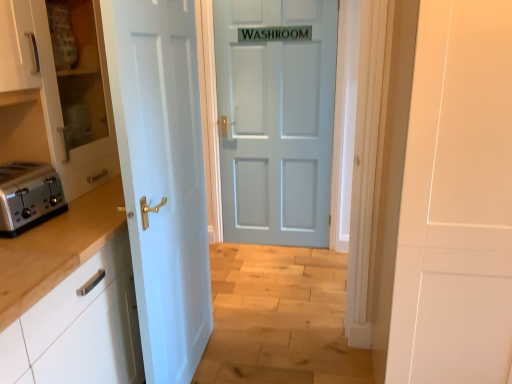
The width and height of the screenshot is (512, 384). What are the coordinates of `white glossy cabinet at left, the 1th cabinetry ordered from the bottom` in the screenshot? It's located at (80, 327).

Image resolution: width=512 pixels, height=384 pixels. What do you see at coordinates (57, 95) in the screenshot?
I see `white glossy cabinet at left, the first cabinetry in the top-to-bottom sequence` at bounding box center [57, 95].

This screenshot has height=384, width=512. In order to click on satin silver toaster at left in this screenshot , I will do `click(28, 196)`.

Is white glossy cabinet at left, acting as the second cabinetry starting from the top, aimed at light blue matte door at center, placed as the second door when sorted from left to right?

No, white glossy cabinet at left, acting as the second cabinetry starting from the top, is not oriented towards light blue matte door at center, placed as the second door when sorted from left to right.

Is white glossy cabinet at left, acting as the second cabinetry starting from the top, in contact with light blue matte door at center, positioned as the 1th door in right-to-left order?

They are not placed beside each other.

From a real-world perspective, which is physically below, white glossy cabinet at left, the 1th cabinetry ordered from the bottom, or light blue matte door at center, placed as the second door when sorted from left to right?

white glossy cabinet at left, the 1th cabinetry ordered from the bottom, from a real-world perspective.

Considering the sizes of white glossy cabinet at left, acting as the second cabinetry starting from the top, and light blue matte door at center, placed as the second door when sorted from left to right, in the image, is white glossy cabinet at left, acting as the second cabinetry starting from the top, wider or thinner than light blue matte door at center, placed as the second door when sorted from left to right,?

In the image, white glossy cabinet at left, acting as the second cabinetry starting from the top, appears to be wider than light blue matte door at center, placed as the second door when sorted from left to right.

Would you consider white painted wood door at left, positioned as the second door in back-to-front order, to be distant from satin silver toaster at left?

No, white painted wood door at left, positioned as the second door in back-to-front order, is in close proximity to satin silver toaster at left.

From a real-world perspective, who is located higher, white painted wood door at left, the 2th door viewed from the right, or satin silver toaster at left?

satin silver toaster at left is physically above.

Does point (127, 106) lie behind point (61, 205)?

No, it is not.

Is white painted wood door at left, the 2th door viewed from the right, turned away from satin silver toaster at left?

That's right, white painted wood door at left, the 2th door viewed from the right, is facing away from satin silver toaster at left.

From the image's perspective, which object appears higher, white glossy cabinet at left, the first cabinetry in the top-to-bottom sequence, or white glossy cabinet at left, the 1th cabinetry ordered from the bottom?

white glossy cabinet at left, the first cabinetry in the top-to-bottom sequence.

What's the angular difference between white glossy cabinet at left, the first cabinetry in the top-to-bottom sequence, and white glossy cabinet at left, the 1th cabinetry ordered from the bottom,'s facing directions?

There is a 0.953-degree angle between the facing directions of white glossy cabinet at left, the first cabinetry in the top-to-bottom sequence, and white glossy cabinet at left, the 1th cabinetry ordered from the bottom.

From a real-world perspective, is white glossy cabinet at left, which ranks as the 2th cabinetry in bottom-to-top order, positioned over white glossy cabinet at left, acting as the second cabinetry starting from the top, based on gravity?

Yes, from a real-world perspective, white glossy cabinet at left, which ranks as the 2th cabinetry in bottom-to-top order, is above white glossy cabinet at left, acting as the second cabinetry starting from the top.

Does white glossy cabinet at left, which ranks as the 2th cabinetry in bottom-to-top order, have a smaller size compared to white glossy cabinet at left, the 1th cabinetry ordered from the bottom?

Indeed, white glossy cabinet at left, which ranks as the 2th cabinetry in bottom-to-top order, has a smaller size compared to white glossy cabinet at left, the 1th cabinetry ordered from the bottom.

Consider the image. Is light blue matte door at center, placed as the second door when sorted from left to right, wider or thinner than white glossy cabinet at left, which ranks as the 2th cabinetry in bottom-to-top order?

In the image, light blue matte door at center, placed as the second door when sorted from left to right, appears to be more narrow than white glossy cabinet at left, which ranks as the 2th cabinetry in bottom-to-top order.

Based on their sizes in the image, would you say light blue matte door at center, placed as the second door when sorted from left to right, is bigger or smaller than white glossy cabinet at left, which ranks as the 2th cabinetry in bottom-to-top order?

Considering their sizes, light blue matte door at center, placed as the second door when sorted from left to right, takes up less space than white glossy cabinet at left, which ranks as the 2th cabinetry in bottom-to-top order.

This screenshot has height=384, width=512. Identify the location of the 1st door positioned below the white glossy cabinet at left, the first cabinetry in the top-to-bottom sequence (from a real-world perspective). (276, 118).

Is light blue matte door at center, which is the 1th door in back-to-front order, not close to white glossy cabinet at left, which ranks as the 2th cabinetry in bottom-to-top order?

Yes, light blue matte door at center, which is the 1th door in back-to-front order, is far from white glossy cabinet at left, which ranks as the 2th cabinetry in bottom-to-top order.

There is a white glossy cabinet at left, the 1th cabinetry ordered from the bottom. Where is `the 2nd door above it (from a real-world perspective)`? This screenshot has height=384, width=512. the 2nd door above it (from a real-world perspective) is located at coordinates (276, 118).

From the image's perspective, is light blue matte door at center, positioned as the 1th door in right-to-left order, above white glossy cabinet at left, acting as the second cabinetry starting from the top?

Yes, from the image's perspective, light blue matte door at center, positioned as the 1th door in right-to-left order, is over white glossy cabinet at left, acting as the second cabinetry starting from the top.

Considering the relative sizes of light blue matte door at center, positioned as the 1th door in right-to-left order, and white glossy cabinet at left, acting as the second cabinetry starting from the top, in the image provided, is light blue matte door at center, positioned as the 1th door in right-to-left order, wider than white glossy cabinet at left, acting as the second cabinetry starting from the top,?

In fact, light blue matte door at center, positioned as the 1th door in right-to-left order, might be narrower than white glossy cabinet at left, acting as the second cabinetry starting from the top.

Is light blue matte door at center, placed as the second door when sorted from left to right, aimed at white glossy cabinet at left, acting as the second cabinetry starting from the top?

Yes, light blue matte door at center, placed as the second door when sorted from left to right, is facing white glossy cabinet at left, acting as the second cabinetry starting from the top.

Is white glossy cabinet at left, the first cabinetry in the top-to-bottom sequence, inside the boundaries of white painted wood door at left, the 2th door viewed from the right, or outside?

white glossy cabinet at left, the first cabinetry in the top-to-bottom sequence, lies outside white painted wood door at left, the 2th door viewed from the right.

From a real-world perspective, is white glossy cabinet at left, which ranks as the 2th cabinetry in bottom-to-top order, under white painted wood door at left, marked as the first door in a left-to-right arrangement?

No, from a real-world perspective, white glossy cabinet at left, which ranks as the 2th cabinetry in bottom-to-top order, is not beneath white painted wood door at left, marked as the first door in a left-to-right arrangement.

Is white glossy cabinet at left, which ranks as the 2th cabinetry in bottom-to-top order, at the left side of white painted wood door at left, the 2th door viewed from the right?

Indeed, white glossy cabinet at left, which ranks as the 2th cabinetry in bottom-to-top order, is positioned on the left side of white painted wood door at left, the 2th door viewed from the right.

This screenshot has height=384, width=512. What are the coordinates of `door above the satin silver toaster at left (from the image's perspective)` in the screenshot? It's located at (276, 118).

Is satin silver toaster at left touching light blue matte door at center, positioned as the 1th door in right-to-left order?

satin silver toaster at left and light blue matte door at center, positioned as the 1th door in right-to-left order, are not in contact.

Is satin silver toaster at left in front of or behind light blue matte door at center, placed as the second door when sorted from left to right, in the image?

satin silver toaster at left is in front of light blue matte door at center, placed as the second door when sorted from left to right.

From a real-world perspective, relative to light blue matte door at center, the 2th door positioned from the front, is satin silver toaster at left vertically above or below?

In terms of real-world spatial position, satin silver toaster at left is above light blue matte door at center, the 2th door positioned from the front.

Locate an element on the screen. door that is the 2nd object to the right of the white glossy cabinet at left, the 1th cabinetry ordered from the bottom, starting at the anchor is located at coordinates (276, 118).

Where is `toaster that is above the white painted wood door at left, marked as the first door in a left-to-right arrangement (from a real-world perspective)`? This screenshot has height=384, width=512. toaster that is above the white painted wood door at left, marked as the first door in a left-to-right arrangement (from a real-world perspective) is located at coordinates (28, 196).

Based on their spatial positions, is white glossy cabinet at left, which ranks as the 2th cabinetry in bottom-to-top order, or white glossy cabinet at left, acting as the second cabinetry starting from the top, further from satin silver toaster at left?

white glossy cabinet at left, acting as the second cabinetry starting from the top, lies further to satin silver toaster at left than the other object.

Considering their positions, is white glossy cabinet at left, the first cabinetry in the top-to-bottom sequence, positioned closer to light blue matte door at center, the 2th door positioned from the front, than white painted wood door at left, positioned as the second door in back-to-front order?

Among the two, white painted wood door at left, positioned as the second door in back-to-front order, is located nearer to light blue matte door at center, the 2th door positioned from the front.

Considering their positions, is satin silver toaster at left positioned closer to white glossy cabinet at left, the 1th cabinetry ordered from the bottom, than light blue matte door at center, positioned as the 1th door in right-to-left order?

Based on the image, satin silver toaster at left appears to be nearer to white glossy cabinet at left, the 1th cabinetry ordered from the bottom.

Looking at the image, which one is located closer to white glossy cabinet at left, which ranks as the 2th cabinetry in bottom-to-top order, white glossy cabinet at left, acting as the second cabinetry starting from the top, or white painted wood door at left, marked as the first door in a left-to-right arrangement?

white painted wood door at left, marked as the first door in a left-to-right arrangement.

Looking at the image, which one is located closer to satin silver toaster at left, white glossy cabinet at left, the 1th cabinetry ordered from the bottom, or light blue matte door at center, placed as the second door when sorted from left to right?

white glossy cabinet at left, the 1th cabinetry ordered from the bottom, is closer to satin silver toaster at left.

Considering their positions, is white glossy cabinet at left, the first cabinetry in the top-to-bottom sequence, positioned further to light blue matte door at center, which is the 1th door in back-to-front order, than white glossy cabinet at left, acting as the second cabinetry starting from the top?

white glossy cabinet at left, acting as the second cabinetry starting from the top.

Estimate the real-world distances between objects in this image. Which object is further from white glossy cabinet at left, the first cabinetry in the top-to-bottom sequence, white painted wood door at left, marked as the first door in a left-to-right arrangement, or satin silver toaster at left?

white painted wood door at left, marked as the first door in a left-to-right arrangement, is further to white glossy cabinet at left, the first cabinetry in the top-to-bottom sequence.

Looking at the image, which one is located further to white glossy cabinet at left, the 1th cabinetry ordered from the bottom, white glossy cabinet at left, which ranks as the 2th cabinetry in bottom-to-top order, or satin silver toaster at left?

white glossy cabinet at left, which ranks as the 2th cabinetry in bottom-to-top order.

I want to click on cabinetry between white painted wood door at left, the 2th door viewed from the right, and light blue matte door at center, placed as the second door when sorted from left to right, from front to back, so click(x=57, y=95).

Where is `door between white glossy cabinet at left, the 1th cabinetry ordered from the bottom, and light blue matte door at center, positioned as the 1th door in right-to-left order, in the front-back direction`? Image resolution: width=512 pixels, height=384 pixels. door between white glossy cabinet at left, the 1th cabinetry ordered from the bottom, and light blue matte door at center, positioned as the 1th door in right-to-left order, in the front-back direction is located at coordinates (162, 177).

Where is `toaster that lies between white glossy cabinet at left, which ranks as the 2th cabinetry in bottom-to-top order, and white glossy cabinet at left, the 1th cabinetry ordered from the bottom, from top to bottom`? Image resolution: width=512 pixels, height=384 pixels. toaster that lies between white glossy cabinet at left, which ranks as the 2th cabinetry in bottom-to-top order, and white glossy cabinet at left, the 1th cabinetry ordered from the bottom, from top to bottom is located at coordinates (28, 196).

Where is `cabinetry positioned between satin silver toaster at left and light blue matte door at center, which is the 1th door in back-to-front order, from near to far`? cabinetry positioned between satin silver toaster at left and light blue matte door at center, which is the 1th door in back-to-front order, from near to far is located at coordinates (57, 95).